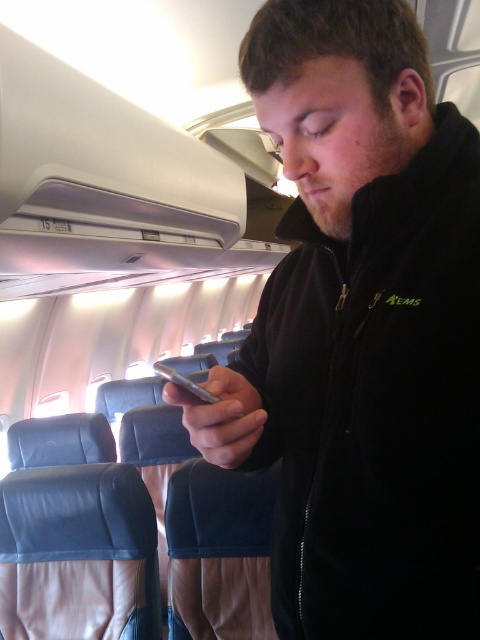
Question: Estimate the real-world distances between objects in this image. Which object is farther from the green fabric aems at center?

Choices:
 (A) silver metallic smartphone at center
 (B) black fleece jacket at center

Answer: (A)

Question: Is black fleece jacket at center thinner than green fabric aems at center?

Choices:
 (A) no
 (B) yes

Answer: (A)

Question: Is black fleece jacket at center bigger than green fabric aems at center?

Choices:
 (A) no
 (B) yes

Answer: (B)

Question: Which point is farther to the camera?

Choices:
 (A) (187, 387)
 (B) (325, 250)
 (C) (397, 301)

Answer: (B)

Question: Considering the real-world distances, which object is closest to the silver metallic smartphone at center?

Choices:
 (A) black fleece jacket at center
 (B) green fabric aems at center

Answer: (A)

Question: Can you confirm if silver metallic smartphone at center is positioned to the right of green fabric aems at center?

Choices:
 (A) no
 (B) yes

Answer: (A)